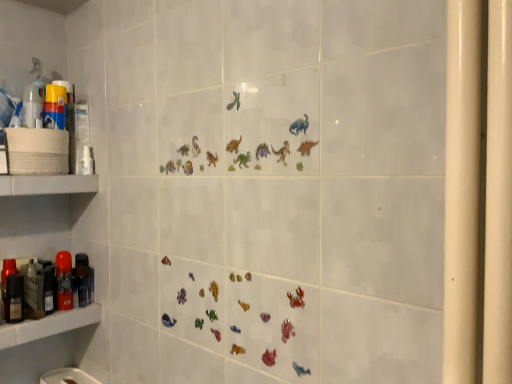
Question: Does matte red spray can at left, which appears as the 2th toiletry when viewed from the front, appear on the left side of matte plastic shelf at lower left, which is the 2th shelf in top-to-bottom order?

Choices:
 (A) no
 (B) yes

Answer: (A)

Question: Considering the relative sizes of matte red spray can at left, which appears as the 2th toiletry when viewed from the front, and matte plastic shelf at lower left, which is the 2th shelf in top-to-bottom order, in the image provided, is matte red spray can at left, which appears as the 2th toiletry when viewed from the front, taller than matte plastic shelf at lower left, which is the 2th shelf in top-to-bottom order,?

Choices:
 (A) no
 (B) yes

Answer: (B)

Question: Is matte red spray can at left, arranged as the 2th toiletry when viewed from the right, not near matte plastic shelf at lower left, which is the 2th shelf in top-to-bottom order?

Choices:
 (A) no
 (B) yes

Answer: (A)

Question: Considering the relative sizes of matte red spray can at left, which appears as the 2th toiletry when viewed from the front, and matte plastic shelf at lower left, the 1th shelf in the bottom-to-top sequence, in the image provided, is matte red spray can at left, which appears as the 2th toiletry when viewed from the front, smaller than matte plastic shelf at lower left, the 1th shelf in the bottom-to-top sequence,?

Choices:
 (A) no
 (B) yes

Answer: (B)

Question: From the image's perspective, is matte red spray can at left, the 2th toiletry from the left, on matte plastic shelf at lower left, the 1th shelf in the bottom-to-top sequence?

Choices:
 (A) yes
 (B) no

Answer: (A)

Question: Is matte red spray can at left, arranged as the 2th toiletry when viewed from the right, oriented away from matte plastic shelf at lower left, which is the 2th shelf in top-to-bottom order?

Choices:
 (A) no
 (B) yes

Answer: (A)

Question: Can you confirm if matte plastic shelf at lower left, which is the 2th shelf in top-to-bottom order, is thinner than translucent plastic spray bottle at left?

Choices:
 (A) yes
 (B) no

Answer: (B)

Question: Can you confirm if matte plastic shelf at lower left, which is the 2th shelf in top-to-bottom order, is bigger than translucent plastic spray bottle at left?

Choices:
 (A) no
 (B) yes

Answer: (B)

Question: Is matte plastic shelf at lower left, the 1th shelf in the bottom-to-top sequence, touching translucent plastic spray bottle at left?

Choices:
 (A) no
 (B) yes

Answer: (A)

Question: Is matte plastic shelf at lower left, which is the 2th shelf in top-to-bottom order, facing away from translucent plastic spray bottle at left?

Choices:
 (A) no
 (B) yes

Answer: (A)

Question: From the image's perspective, would you say matte plastic shelf at lower left, which is the 2th shelf in top-to-bottom order, is shown under translucent plastic spray bottle at left?

Choices:
 (A) no
 (B) yes

Answer: (B)

Question: From the image's perspective, does matte plastic shelf at lower left, which is the 2th shelf in top-to-bottom order, appear higher than translucent plastic spray bottle at left?

Choices:
 (A) yes
 (B) no

Answer: (B)

Question: Considering the relative sizes of metallic black hairdryer at left, the third toiletry from the front, and translucent plastic spray bottle at left in the image provided, is metallic black hairdryer at left, the third toiletry from the front, thinner than translucent plastic spray bottle at left?

Choices:
 (A) yes
 (B) no

Answer: (B)